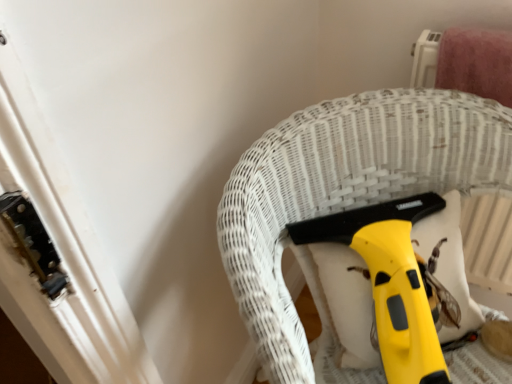
The image size is (512, 384). What do you see at coordinates (346, 188) in the screenshot? I see `yellow plastic vacuum cleaner at center` at bounding box center [346, 188].

Measure the distance between yellow plastic vacuum cleaner at center and camera.

A distance of 19.83 inches exists between yellow plastic vacuum cleaner at center and camera.

Find the location of a particular element. yellow plastic vacuum cleaner at center is located at coordinates (346, 188).

Find the location of a particular element. Image resolution: width=512 pixels, height=384 pixels. yellow plastic squeegee at center is located at coordinates (391, 281).

Image resolution: width=512 pixels, height=384 pixels. What do you see at coordinates (391, 281) in the screenshot?
I see `yellow plastic squeegee at center` at bounding box center [391, 281].

Find the location of a particular element. The height and width of the screenshot is (384, 512). yellow plastic vacuum cleaner at center is located at coordinates [346, 188].

Looking at this image, considering the relative positions of yellow plastic squeegee at center and yellow plastic vacuum cleaner at center in the image provided, is yellow plastic squeegee at center to the left or to the right of yellow plastic vacuum cleaner at center?

yellow plastic squeegee at center is to the left of yellow plastic vacuum cleaner at center.

Considering the positions of objects yellow plastic squeegee at center and yellow plastic vacuum cleaner at center in the image provided, who is in front, yellow plastic squeegee at center or yellow plastic vacuum cleaner at center?

yellow plastic vacuum cleaner at center is closer to the camera.

Considering the points (391, 323) and (319, 174), which point is in front, point (391, 323) or point (319, 174)?

The point (391, 323) is closer to the camera.

From the image's perspective, does yellow plastic squeegee at center appear lower than yellow plastic vacuum cleaner at center?

No, from the image's perspective, yellow plastic squeegee at center is not below yellow plastic vacuum cleaner at center.

From a real-world perspective, is yellow plastic squeegee at center located beneath yellow plastic vacuum cleaner at center?

No.

Considering the sizes of objects yellow plastic squeegee at center and yellow plastic vacuum cleaner at center in the image provided, who is thinner, yellow plastic squeegee at center or yellow plastic vacuum cleaner at center?

yellow plastic squeegee at center.

Considering the relative sizes of yellow plastic squeegee at center and yellow plastic vacuum cleaner at center in the image provided, is yellow plastic squeegee at center taller than yellow plastic vacuum cleaner at center?

No.

Between yellow plastic squeegee at center and yellow plastic vacuum cleaner at center, which one has larger size?

With larger size is yellow plastic vacuum cleaner at center.

Would you say yellow plastic vacuum cleaner at center is part of yellow plastic squeegee at center's contents?

No, yellow plastic vacuum cleaner at center is located outside of yellow plastic squeegee at center.

Is yellow plastic squeegee at center next to yellow plastic vacuum cleaner at center?

No, yellow plastic squeegee at center is not with yellow plastic vacuum cleaner at center.

Is yellow plastic squeegee at center facing away from yellow plastic vacuum cleaner at center?

Yes, yellow plastic squeegee at center is facing away from yellow plastic vacuum cleaner at center.

From the picture: Can you tell me how much yellow plastic squeegee at center and yellow plastic vacuum cleaner at center differ in facing direction?

The facing directions of yellow plastic squeegee at center and yellow plastic vacuum cleaner at center are 3.72 degrees apart.

Find the location of `tool above the yellow plastic vacuum cleaner at center (from the image's perspective)`. tool above the yellow plastic vacuum cleaner at center (from the image's perspective) is located at coordinates (391, 281).

Considering the positions of objects yellow plastic vacuum cleaner at center and yellow plastic squeegee at center in the image provided, who is more to the right, yellow plastic vacuum cleaner at center or yellow plastic squeegee at center?

From the viewer's perspective, yellow plastic vacuum cleaner at center appears more on the right side.

Is yellow plastic vacuum cleaner at center closer to camera compared to yellow plastic squeegee at center?

Yes, yellow plastic vacuum cleaner at center is in front of yellow plastic squeegee at center.

Which is further, (337,115) or (378,341)?

Positioned behind is point (337,115).

Looking at this image, from the image's perspective, is yellow plastic vacuum cleaner at center positioned above or below yellow plastic squeegee at center?

yellow plastic vacuum cleaner at center is below yellow plastic squeegee at center.

From a real-world perspective, is yellow plastic vacuum cleaner at center positioned over yellow plastic squeegee at center based on gravity?

No.

Can you confirm if yellow plastic vacuum cleaner at center is thinner than yellow plastic squeegee at center?

Incorrect, the width of yellow plastic vacuum cleaner at center is not less than that of yellow plastic squeegee at center.

Is yellow plastic vacuum cleaner at center shorter than yellow plastic squeegee at center?

No, yellow plastic vacuum cleaner at center is not shorter than yellow plastic squeegee at center.

Who is smaller, yellow plastic vacuum cleaner at center or yellow plastic squeegee at center?

Smaller between the two is yellow plastic squeegee at center.

Is yellow plastic vacuum cleaner at center inside the boundaries of yellow plastic squeegee at center, or outside?

yellow plastic vacuum cleaner at center exists outside the volume of yellow plastic squeegee at center.

Are yellow plastic vacuum cleaner at center and yellow plastic squeegee at center making contact?

No, yellow plastic vacuum cleaner at center is not with yellow plastic squeegee at center.

Consider the image. Is yellow plastic vacuum cleaner at center facing towards yellow plastic squeegee at center?

Yes, yellow plastic vacuum cleaner at center is oriented towards yellow plastic squeegee at center.

How far apart are yellow plastic vacuum cleaner at center and yellow plastic squeegee at center?

yellow plastic vacuum cleaner at center is 12.06 centimeters from yellow plastic squeegee at center.

Locate an element on the screen. The image size is (512, 384). tool located above the yellow plastic vacuum cleaner at center (from the image's perspective) is located at coordinates (391, 281).

Locate an element on the screen. The height and width of the screenshot is (384, 512). tool on the left of the yellow plastic vacuum cleaner at center is located at coordinates (391, 281).

The width and height of the screenshot is (512, 384). In order to click on tool above the yellow plastic vacuum cleaner at center (from a real-world perspective) in this screenshot , I will do `click(391, 281)`.